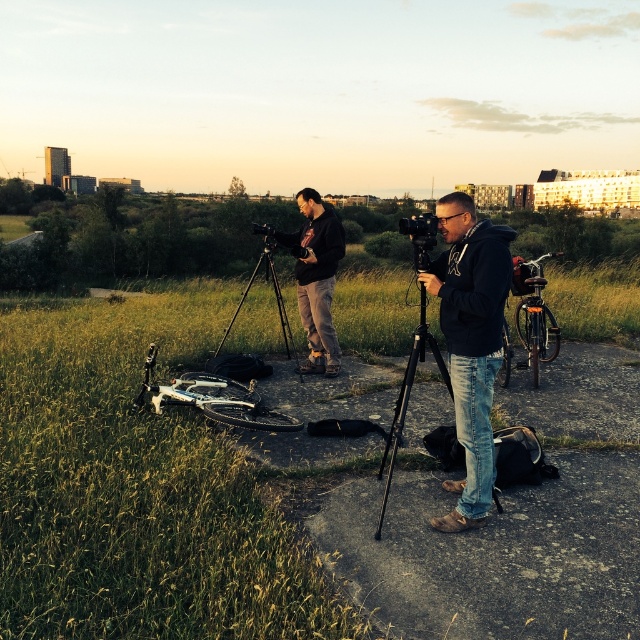
Question: Is matte black tripod at center closer to the viewer compared to black matte tripod at center?

Choices:
 (A) no
 (B) yes

Answer: (B)

Question: Does black matte tripod at center appear on the right side of black plastic camera at center?

Choices:
 (A) yes
 (B) no

Answer: (B)

Question: Observing the image, what is the correct spatial positioning of black matte jacket at center in reference to black plastic camera at center?

Choices:
 (A) left
 (B) right

Answer: (B)

Question: Which point is closer to the camera taking this photo?

Choices:
 (A) (323, 278)
 (B) (264, 234)
 (C) (460, 316)
 (D) (420, 216)

Answer: (C)

Question: Which object is the farthest from the black plastic camera at center?

Choices:
 (A) matte black tripod at center
 (B) black matte tripod at center

Answer: (B)

Question: Which of the following is the farthest from the observer?

Choices:
 (A) black matte jacket at center
 (B) black plastic camera at center
 (C) black matte tripod at center

Answer: (C)